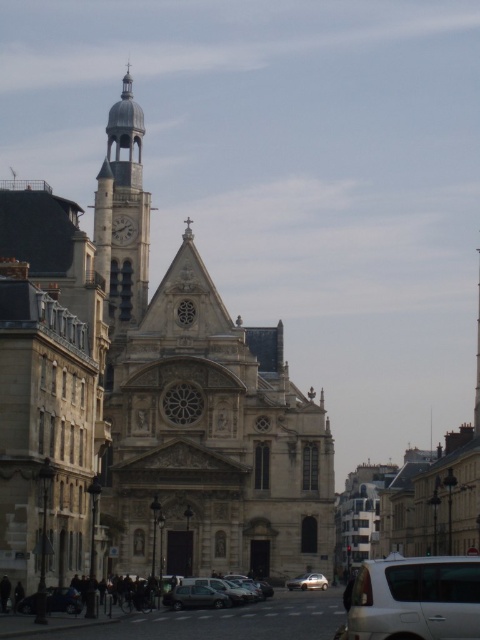
You are a delivery person trying to park your white matte car at lower right between the metallic silver car at center and the curb. Can your car fit in that space?

The white matte car at lower right is bigger than the metallic silver car at center. Therefore, it may not fit in the space between the metallic silver car at center and the curb unless the space is sufficiently large to accommodate its size.

You are a pedestrian standing on the sidewalk in front of the historic church. You notice two cars parked at the center of the scene. Which car, the metallic silver car at center or the dark gray metallic car at center, is positioned closer to the ground?

The metallic silver car at center is positioned closer to the ground because it is located below the dark gray metallic car at center.